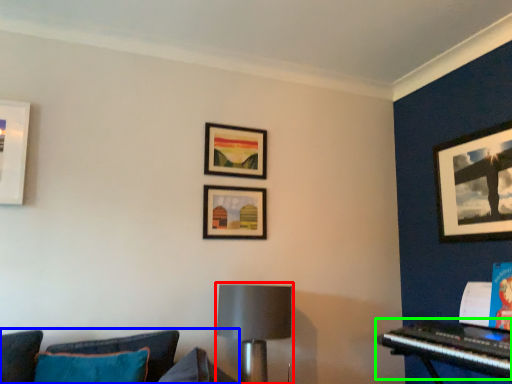
Question: Based on their relative distances, which object is farther from lamp (highlighted by a red box)? Choose from studio couch (highlighted by a blue box) and piano (highlighted by a green box).

Choices:
 (A) studio couch
 (B) piano

Answer: (B)